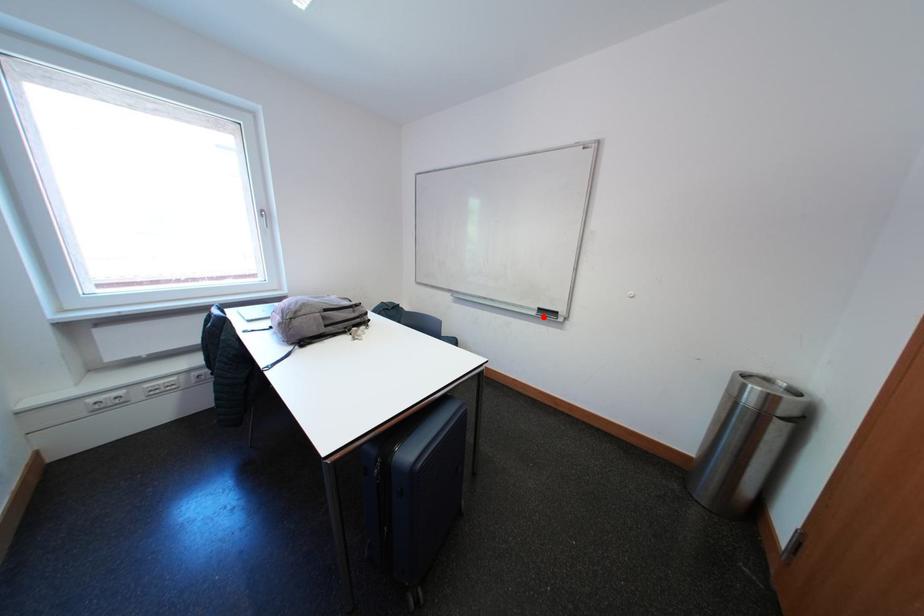
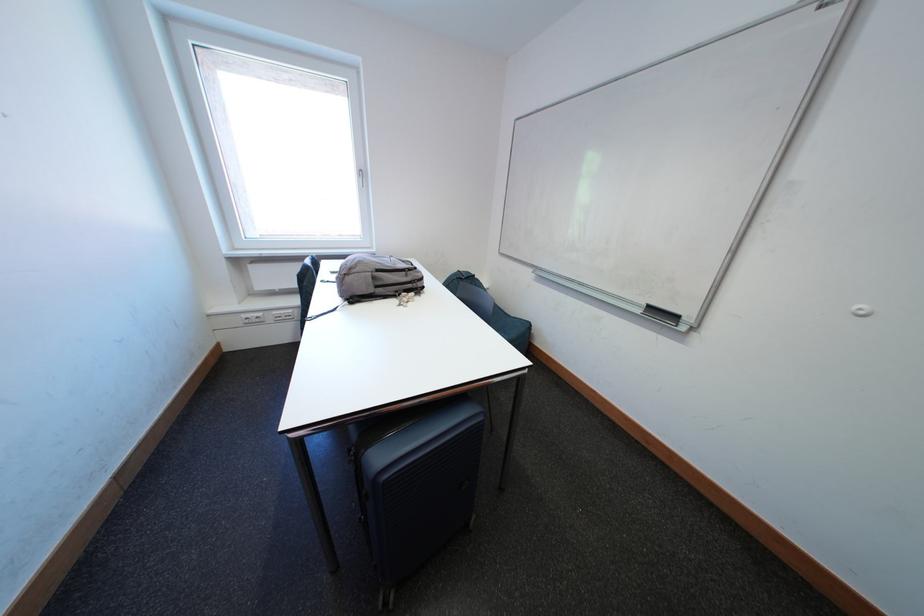
Question: I am providing you with two images of the same scene from different viewpoints. Image1 has a red point marked. In image2, the corresponding 3D location appears at what relative position? Reply with the corresponding letter.

Choices:
 (A) Closer
 (B) Farther

Answer: (A)